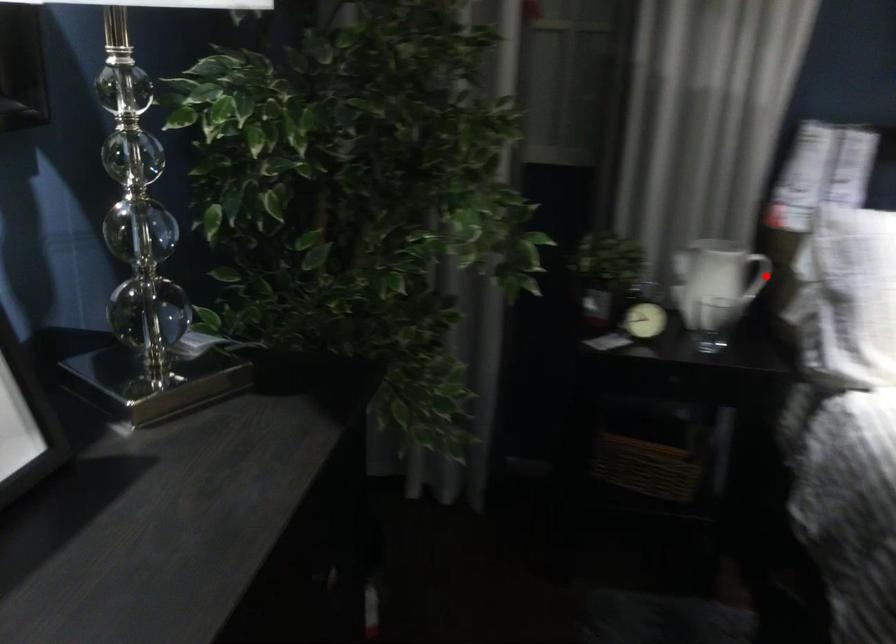
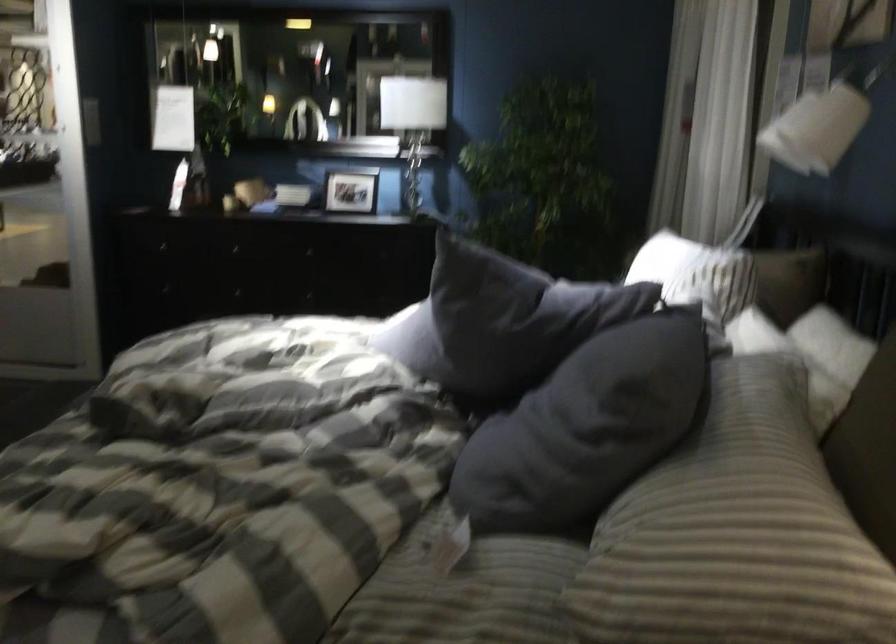
Question: I am providing you with two images of the same scene from different viewpoints. A red point is marked on the first image. At the location where the point appears in image 1, is it still visible in image 2?

Choices:
 (A) Yes
 (B) No

Answer: (B)